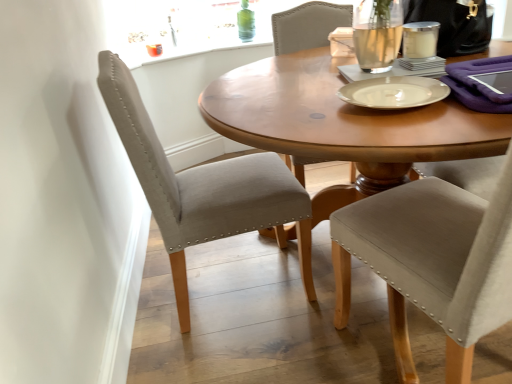
Identify the location of vacant space in front of satin beige chair at left, the second chair viewed from the right. The height and width of the screenshot is (384, 512). (245, 349).